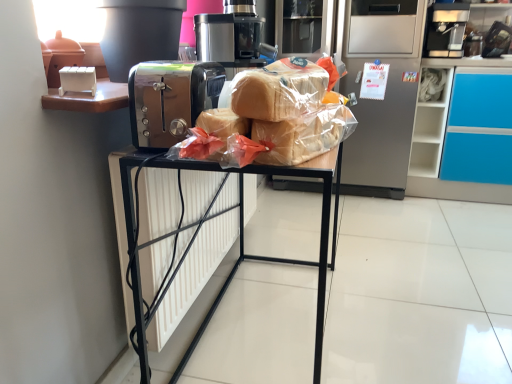
Question: Is translucent plastic bread at center to the left or to the right of black plastic coffee machine at upper right in the image?

Choices:
 (A) right
 (B) left

Answer: (B)

Question: Is translucent plastic bread at center spatially inside black plastic coffee machine at upper right, or outside of it?

Choices:
 (A) outside
 (B) inside

Answer: (A)

Question: Which of these objects is positioned closest to the translucent plastic bread at center?

Choices:
 (A) satin chrome toaster at center
 (B) black plastic coffee machine at upper right
 (C) silver metallic refrigerator at center
 (D) metallic black toaster at center

Answer: (A)

Question: Estimate the real-world distances between objects in this image. Which object is farther from the silver metallic refrigerator at center?

Choices:
 (A) metallic black toaster at center
 (B) translucent plastic bread at center
 (C) black plastic coffee machine at upper right
 (D) satin chrome toaster at center

Answer: (D)